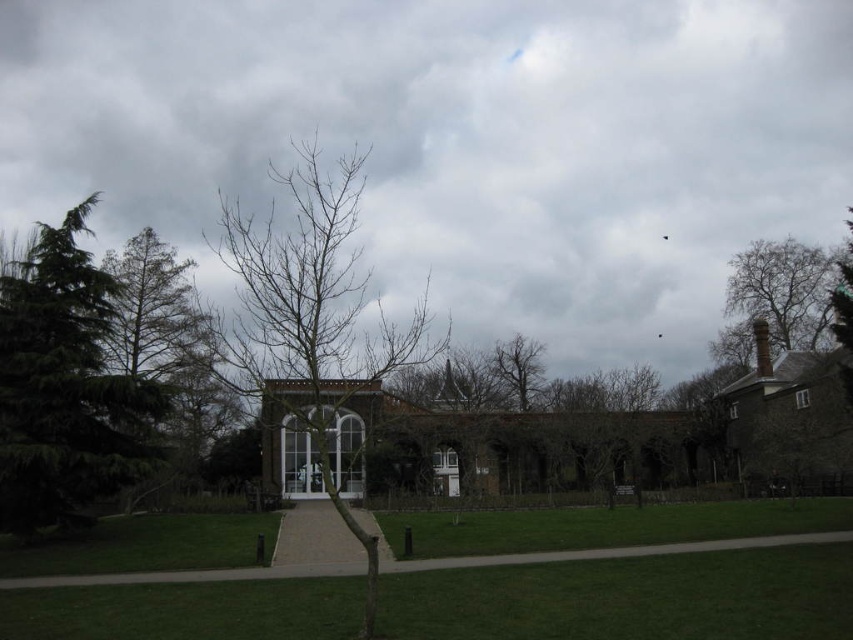
Is green coniferous tree at left to the right of bare branches at upper right from the viewer's perspective?

No, green coniferous tree at left is not to the right of bare branches at upper right.

Does point (103, 296) lie behind point (750, 288)?

No, (103, 296) is closer to viewer.

This screenshot has height=640, width=853. I want to click on green coniferous tree at left, so click(x=67, y=387).

Which is more to the left, green coniferous tree at left or gravel path at lower center?

Positioned to the left is green coniferous tree at left.

Is green coniferous tree at left bigger than gravel path at lower center?

Yes.

Who is more forward, (39, 275) or (148, 580)?

Positioned in front is point (148, 580).

The width and height of the screenshot is (853, 640). I want to click on green coniferous tree at left, so click(x=67, y=387).

Which of these two, bare branches at center or green coniferous tree at left, stands shorter?

With less height is green coniferous tree at left.

Describe the element at coordinates (311, 314) in the screenshot. I see `bare branches at center` at that location.

The image size is (853, 640). I want to click on bare branches at center, so click(311, 314).